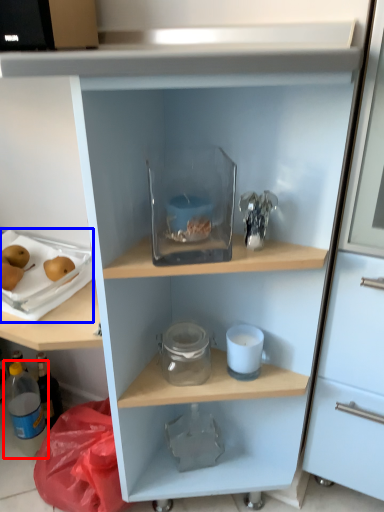
Question: Which point is further to the camera, bottle (highlighted by a red box) or appliance (highlighted by a blue box)?

Choices:
 (A) bottle
 (B) appliance

Answer: (A)